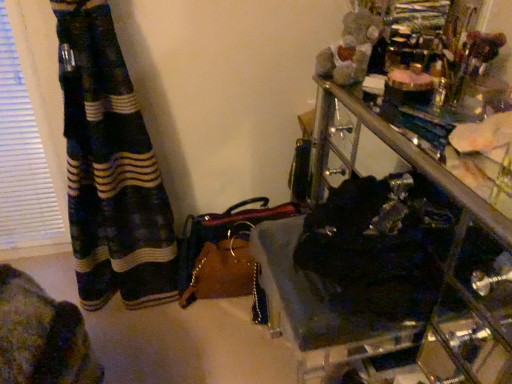
Measure the distance between point (229, 257) and camera.

Point (229, 257) is 1.49 meters away from camera.

Image resolution: width=512 pixels, height=384 pixels. Find the location of `leather handbag at lower center`. leather handbag at lower center is located at coordinates (223, 251).

What do you see at coordinates (223, 251) in the screenshot? I see `leather handbag at lower center` at bounding box center [223, 251].

What is the approximate height of black fabric at center?

black fabric at center is 9.29 inches tall.

This screenshot has width=512, height=384. Describe the element at coordinates (388, 263) in the screenshot. I see `black fabric at center` at that location.

This screenshot has width=512, height=384. I want to click on black fabric at center, so coord(388,263).

The height and width of the screenshot is (384, 512). I want to click on leather handbag at lower center, so click(x=223, y=251).

Based on the photo, considering the positions of objects leather handbag at lower center and black fabric at center in the image provided, who is more to the right, leather handbag at lower center or black fabric at center?

Positioned to the right is black fabric at center.

Considering the positions of objects leather handbag at lower center and black fabric at center in the image provided, who is in front, leather handbag at lower center or black fabric at center?

black fabric at center is closer to the camera.

Does point (291, 214) come closer to viewer compared to point (479, 325)?

No, it is not.

From the image's perspective, which one is positioned lower, leather handbag at lower center or black fabric at center?

From the image's view, leather handbag at lower center is below.

From a real-world perspective, is leather handbag at lower center physically located above or below black fabric at center?

Clearly, from a real-world perspective, leather handbag at lower center is below black fabric at center.

Is leather handbag at lower center wider or thinner than black fabric at center?

Clearly, leather handbag at lower center has more width compared to black fabric at center.

Can you confirm if leather handbag at lower center is shorter than black fabric at center?

Incorrect, the height of leather handbag at lower center does not fall short of that of black fabric at center.

Is leather handbag at lower center bigger than black fabric at center?

Yes.

Is leather handbag at lower center situated inside black fabric at center or outside?

leather handbag at lower center is spatially situated outside black fabric at center.

Is leather handbag at lower center positioned far away from black fabric at center?

No, leather handbag at lower center is in close proximity to black fabric at center.

Is leather handbag at lower center facing away from black fabric at center?

No, leather handbag at lower center's orientation is not away from black fabric at center.

Can you tell me how much leather handbag at lower center and black fabric at center differ in facing direction?

There is a 179-degree angle between the facing directions of leather handbag at lower center and black fabric at center.

Measure the distance from leather handbag at lower center to black fabric at center.

A distance of 18.22 inches exists between leather handbag at lower center and black fabric at center.

The height and width of the screenshot is (384, 512). I want to click on handbag beneath the black fabric at center (from a real-world perspective), so [x=223, y=251].

Is black fabric at center at the left side of leather handbag at lower center?

Incorrect, black fabric at center is not on the left side of leather handbag at lower center.

Is black fabric at center closer to the viewer compared to leather handbag at lower center?

Yes, it is in front of leather handbag at lower center.

Considering the points (327, 343) and (252, 283), which point is behind, point (327, 343) or point (252, 283)?

Positioned behind is point (252, 283).

From the image's perspective, does black fabric at center appear lower than leather handbag at lower center?

No, from the image's perspective, black fabric at center is not below leather handbag at lower center.

Based on the photo, from a real-world perspective, which is physically above, black fabric at center or leather handbag at lower center?

In real-world perspective, black fabric at center is above.

Which object is thinner, black fabric at center or leather handbag at lower center?

Thinner between the two is black fabric at center.

From their relative heights in the image, would you say black fabric at center is taller or shorter than leather handbag at lower center?

black fabric at center is shorter than leather handbag at lower center.

Does black fabric at center have a smaller size compared to leather handbag at lower center?

Yes, black fabric at center is smaller than leather handbag at lower center.

Is black fabric at center not inside leather handbag at lower center?

Yes, black fabric at center is located beyond the bounds of leather handbag at lower center.

Is black fabric at center next to leather handbag at lower center?

No, black fabric at center is not touching leather handbag at lower center.

Is black fabric at center aimed at leather handbag at lower center?

No, black fabric at center is not facing towards leather handbag at lower center.

Can you tell me how much black fabric at center and leather handbag at lower center differ in facing direction?

The angle between the facing direction of black fabric at center and the facing direction of leather handbag at lower center is 179 degrees.

Measure the distance from black fabric at center to leather handbag at lower center.

18.22 inches.

The image size is (512, 384). In order to click on furniture that appears above the leather handbag at lower center (from a real-world perspective) in this screenshot , I will do `click(388, 263)`.

The width and height of the screenshot is (512, 384). I want to click on handbag to the left of black fabric at center, so click(x=223, y=251).

At what (x,y) coordinates should I click in order to perform the action: click on furniture located in front of the leather handbag at lower center. Please return your answer as a coordinate pair (x, y). The width and height of the screenshot is (512, 384). Looking at the image, I should click on (388, 263).